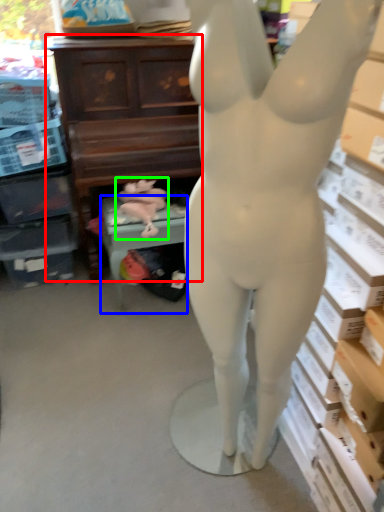
Question: Which is farther away from entertainment center (highlighted by a red box)? furniture (highlighted by a blue box) or animal sculpture (highlighted by a green box)?

Choices:
 (A) furniture
 (B) animal sculpture

Answer: (A)